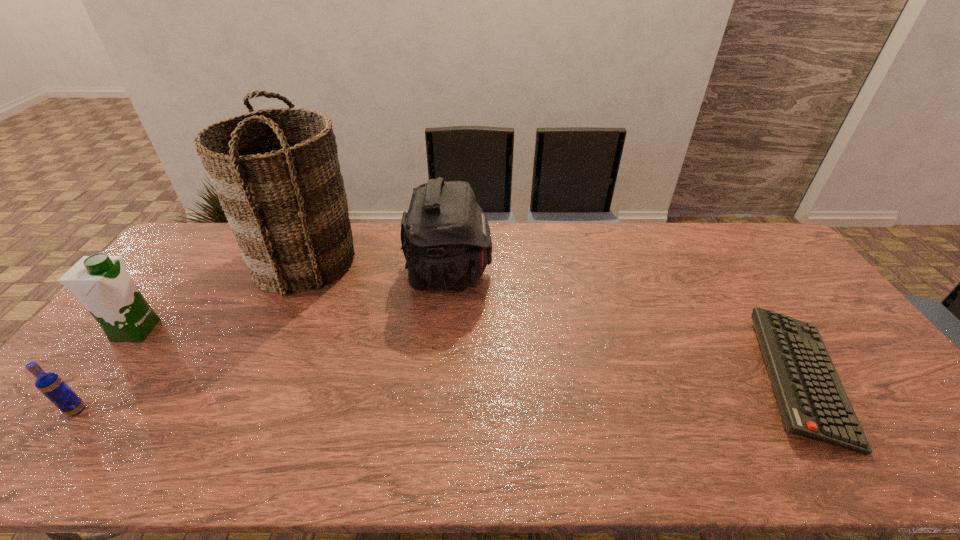
What are the coordinates of `free space between the tallest object and the fourth tallest object` in the screenshot? It's located at (x=191, y=335).

Image resolution: width=960 pixels, height=540 pixels. Identify the location of vacant region between the third tallest object and the vodka. (107, 370).

Locate an element on the screen. vacant point located between the third object from left to right and the second shortest object is located at coordinates (191, 335).

The width and height of the screenshot is (960, 540). Find the location of `free space between the third shortest object and the third object from right to left`. free space between the third shortest object and the third object from right to left is located at coordinates (221, 295).

Point out which object is positioned as the second nearest to the third shortest object. Please provide its 2D coordinates. Your answer should be formatted as a tuple, i.e. [(x, y)], where the tuple contains the x and y coordinates of a point satisfying the conditions above.

[(49, 384)]

Select which object is the closest to the third object from left to right. Please provide its 2D coordinates. Your answer should be formatted as a tuple, i.e. [(x, y)], where the tuple contains the x and y coordinates of a point satisfying the conditions above.

[(446, 240)]

In order to click on vacant space that satisfies the following two spatial constraints: 1. on the front-facing side of the soya milk; 2. on the right side of the vodka in this screenshot , I will do `click(73, 410)`.

Find the location of a particular element. free location that satisfies the following two spatial constraints: 1. on the open flap of the second object from right to left; 2. on the right side of the rightmost object is located at coordinates (441, 379).

I want to click on free location that satisfies the following two spatial constraints: 1. on the front side of the third object from right to left; 2. on the left side of the shortest object, so click(x=251, y=379).

Identify the location of free space in the image that satisfies the following two spatial constraints: 1. on the front-facing side of the shortest object; 2. on the left side of the third shortest object. (98, 379).